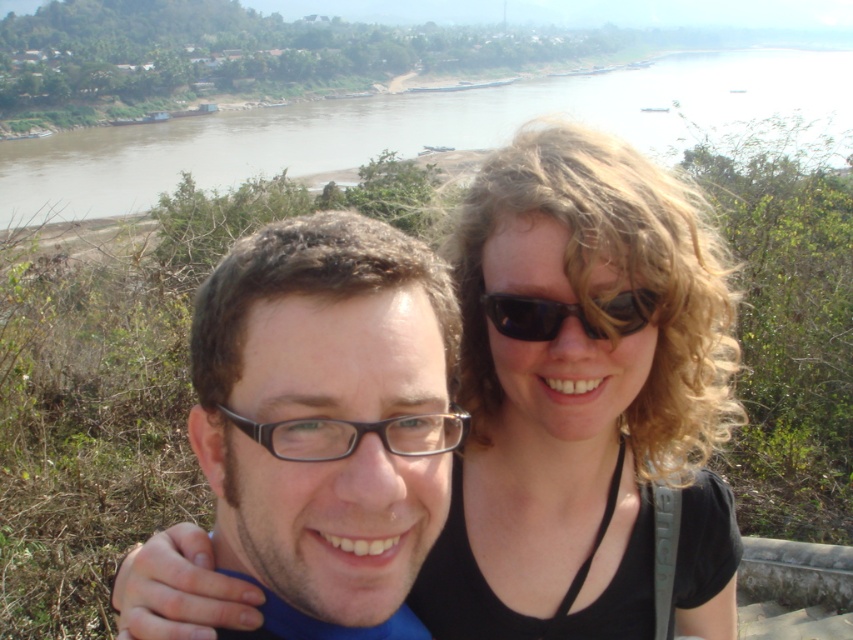
Does matte black glasses at center appear on the right side of black plastic sunglasses at center?

Incorrect, matte black glasses at center is not on the right side of black plastic sunglasses at center.

Does matte black glasses at center have a greater width compared to black plastic sunglasses at center?

Correct, the width of matte black glasses at center exceeds that of black plastic sunglasses at center.

The width and height of the screenshot is (853, 640). What do you see at coordinates (326, 412) in the screenshot?
I see `matte black glasses at center` at bounding box center [326, 412].

Identify the location of matte black glasses at center. This screenshot has width=853, height=640. (326, 412).

Does black matte hair at center lie behind matte black glasses at center?

Yes, it is behind matte black glasses at center.

Which is more to the right, black matte hair at center or matte black glasses at center?

black matte hair at center is more to the right.

Image resolution: width=853 pixels, height=640 pixels. In order to click on black matte hair at center in this screenshot , I will do `click(585, 403)`.

Between black matte hair at center and black plastic sunglasses at center, which one has less height?

With less height is black plastic sunglasses at center.

Does point (535, 369) come closer to viewer compared to point (498, 296)?

That is False.

At what (x,y) coordinates should I click in order to perform the action: click on black matte hair at center. Please return your answer as a coordinate pair (x, y). Looking at the image, I should click on (585, 403).